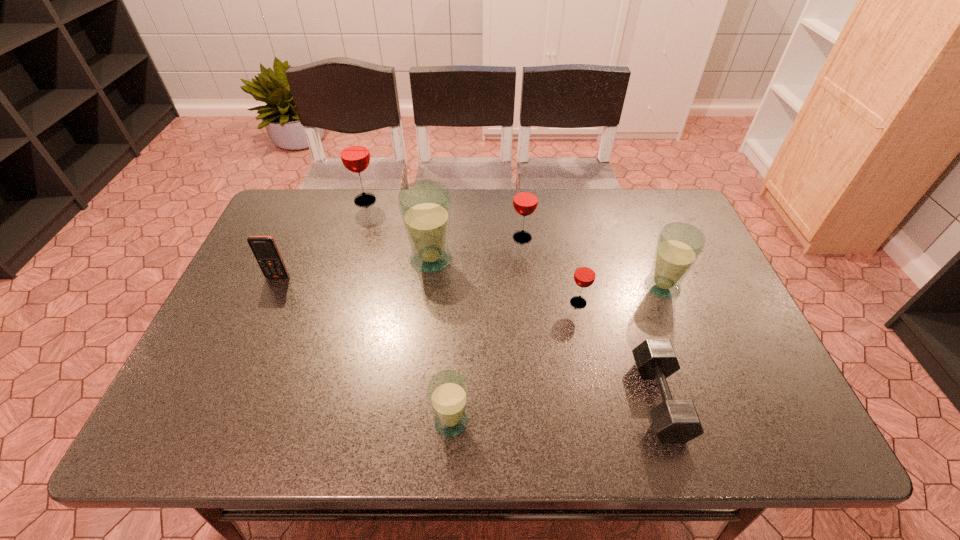
The height and width of the screenshot is (540, 960). I want to click on vacant space located on the right of the nearest red glass, so click(x=716, y=302).

Find the location of a particular element. Image resolution: width=960 pixels, height=540 pixels. free spot located on the right of the smallest blue glass is located at coordinates (566, 421).

The width and height of the screenshot is (960, 540). I want to click on free space located 0.250m on the left of the shortest object, so click(521, 400).

Where is `glass that is positioned at the near edge`? glass that is positioned at the near edge is located at coordinates (448, 391).

The height and width of the screenshot is (540, 960). In order to click on dumbbell located at the near edge in this screenshot , I will do `click(674, 421)`.

At what (x,y) coordinates should I click in order to perform the action: click on object located in the left edge section of the desktop. Please return your answer as a coordinate pair (x, y). This screenshot has width=960, height=540. Looking at the image, I should click on (264, 248).

You are a GUI agent. You are given a task and a screenshot of the screen. Output one action in this format:
    pyautogui.click(x=<x>, y=<y>)
    Task: Click on the object situated at the right edge
    This screenshot has width=960, height=540.
    Given the screenshot: What is the action you would take?
    pyautogui.click(x=679, y=245)

In the image, there is a desktop. At what (x,y) coordinates should I click in order to perform the action: click on vacant space at the far edge. Please return your answer as a coordinate pair (x, y). The width and height of the screenshot is (960, 540). Looking at the image, I should click on (550, 219).

What are the coordinates of `vacant space at the left edge` in the screenshot? It's located at (262, 354).

Find the location of `free space at the right edge of the desktop`. free space at the right edge of the desktop is located at coordinates (708, 387).